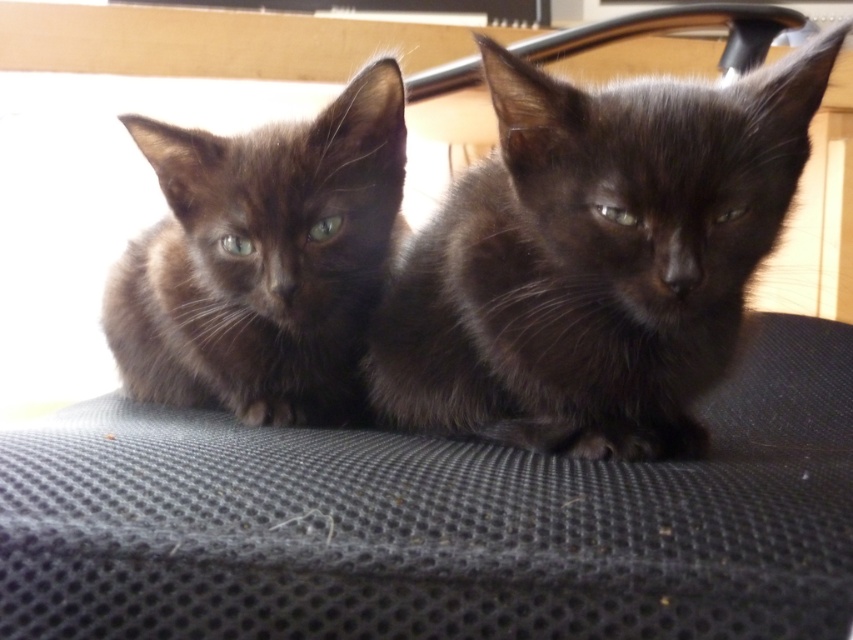
Question: Which point is farther to the camera?

Choices:
 (A) shiny black kitten at left
 (B) shiny black kitten at center

Answer: (A)

Question: Is shiny black kitten at center thinner than shiny black kitten at left?

Choices:
 (A) no
 (B) yes

Answer: (A)

Question: Does shiny black kitten at center have a lesser width compared to shiny black kitten at left?

Choices:
 (A) no
 (B) yes

Answer: (A)

Question: Which point is farther to the camera?

Choices:
 (A) shiny black kitten at left
 (B) shiny black kitten at center

Answer: (A)

Question: Does shiny black kitten at center have a larger size compared to shiny black kitten at left?

Choices:
 (A) yes
 (B) no

Answer: (A)